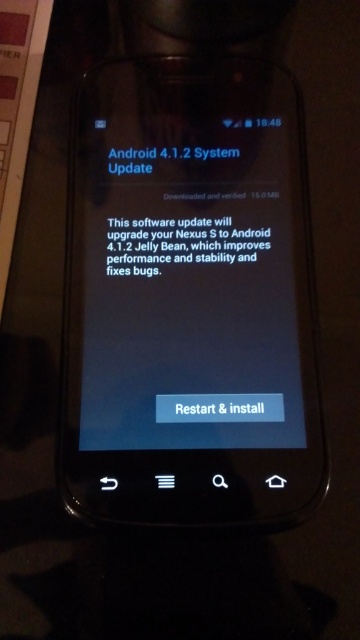
Question: Can you confirm if blue glossy screen at center is positioned above black matte text at center?

Choices:
 (A) yes
 (B) no

Answer: (B)

Question: Which point is closer to the camera?

Choices:
 (A) blue glossy text at upper center
 (B) black matte text at center
 (C) blue glossy screen at center

Answer: (C)

Question: Based on their relative distances, which object is nearer to the blue glossy screen at center?

Choices:
 (A) blue glossy text at upper center
 (B) black matte text at center

Answer: (B)

Question: Among these points, which one is farthest from the camera?

Choices:
 (A) (208, 237)
 (B) (115, 148)

Answer: (B)

Question: Is black matte text at center positioned before blue glossy text at upper center?

Choices:
 (A) no
 (B) yes

Answer: (B)

Question: Does blue glossy screen at center appear under black matte text at center?

Choices:
 (A) no
 (B) yes

Answer: (B)